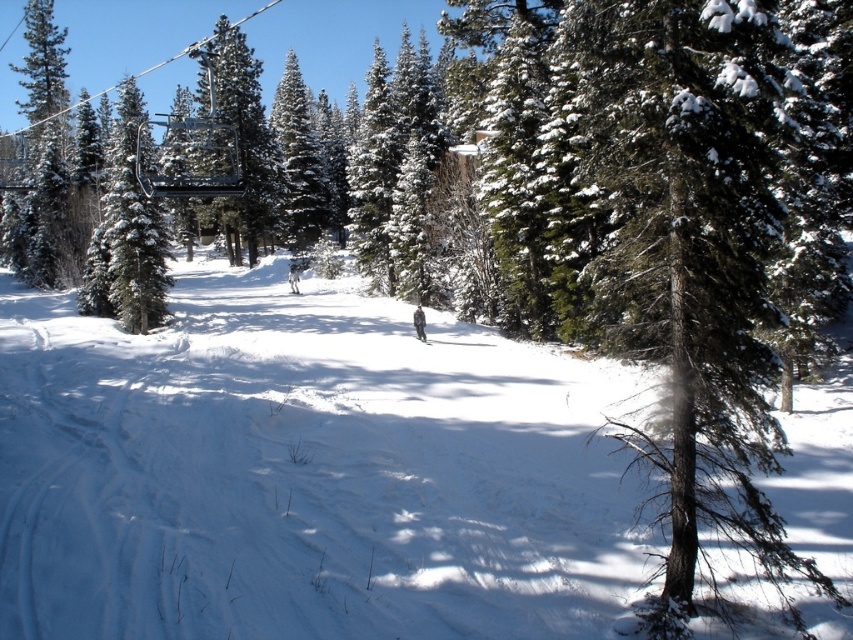
Which is more to the left, white snow at center or green matte evergreen tree at center?

From the viewer's perspective, green matte evergreen tree at center appears more on the left side.

Between white snow at center and green matte evergreen tree at center, which one appears on the right side from the viewer's perspective?

white snow at center

Between point (302, 442) and point (326, 189), which one is positioned in front?

Point (302, 442)

This screenshot has width=853, height=640. In order to click on white snow at center in this screenshot , I will do `click(300, 472)`.

Who is higher up, green matte evergreen tree at center or white plastic ski at center?

Positioned higher is green matte evergreen tree at center.

Locate an element on the screen. This screenshot has width=853, height=640. green matte evergreen tree at center is located at coordinates (299, 160).

This screenshot has width=853, height=640. Describe the element at coordinates (299, 160) in the screenshot. I see `green matte evergreen tree at center` at that location.

In order to click on green matte evergreen tree at center in this screenshot , I will do `click(299, 160)`.

Between white snow at center and white matte ski at center, which one appears on the right side from the viewer's perspective?

Positioned to the right is white snow at center.

Identify the location of white snow at center. (300, 472).

Does point (460, 337) come closer to viewer compared to point (297, 294)?

Yes.

Locate an element on the screen. white snow at center is located at coordinates (300, 472).